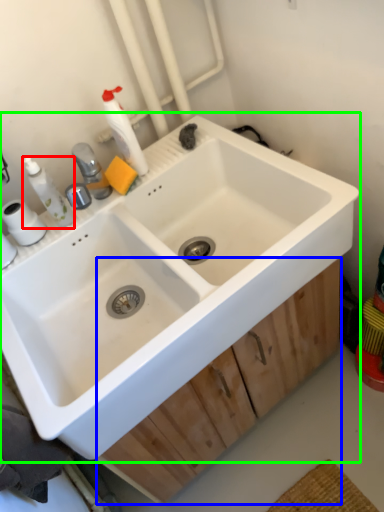
Question: Estimate the real-world distances between objects in this image. Which object is farther from toiletry (highlighted by a red box), drawer (highlighted by a blue box) or sink (highlighted by a green box)?

Choices:
 (A) drawer
 (B) sink

Answer: (A)